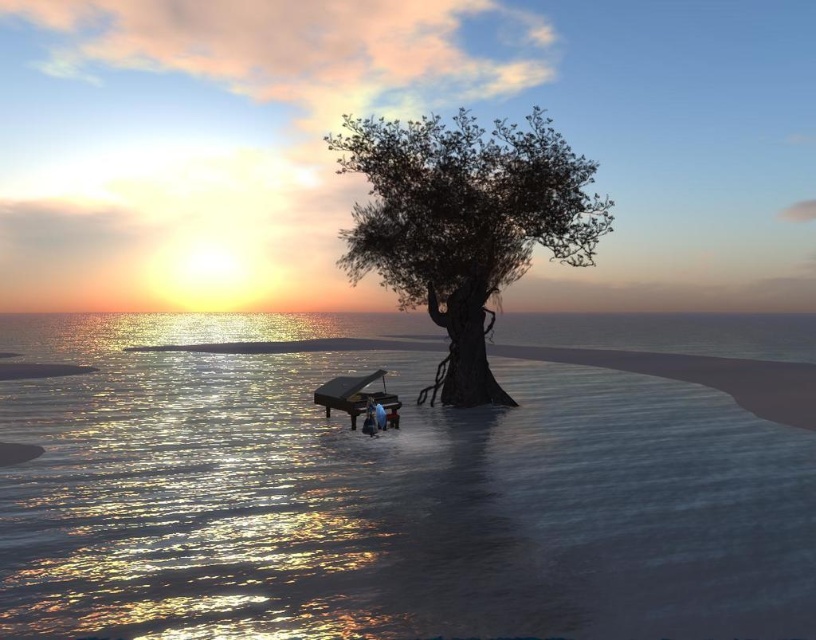
You are a photographer trying to capture the sunset scene. You notice the shiny reflective water at center and the matte blue person at center. Which object is taller in the image?

The shiny reflective water at center is much taller than the matte blue person at center in the image.

You are standing on the shore of the sunset sea scene. There is a point marked at coordinates (x=384, y=497). What does this point represent in the scene?

The point at coordinates (x=384, y=497) corresponds to the shiny reflective water at center.